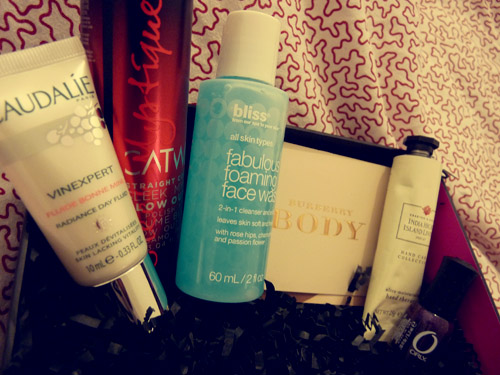
Find the location of a particular element. This screenshot has width=500, height=375. bottle is located at coordinates (248, 232), (179, 158).